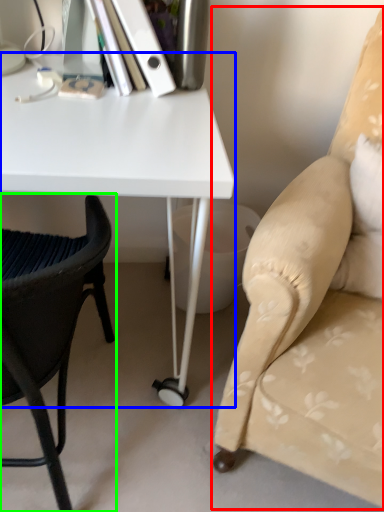
Question: Which is nearer to the chair (highlighted by a red box)? desk (highlighted by a blue box) or chair (highlighted by a green box).

Choices:
 (A) desk
 (B) chair

Answer: (A)